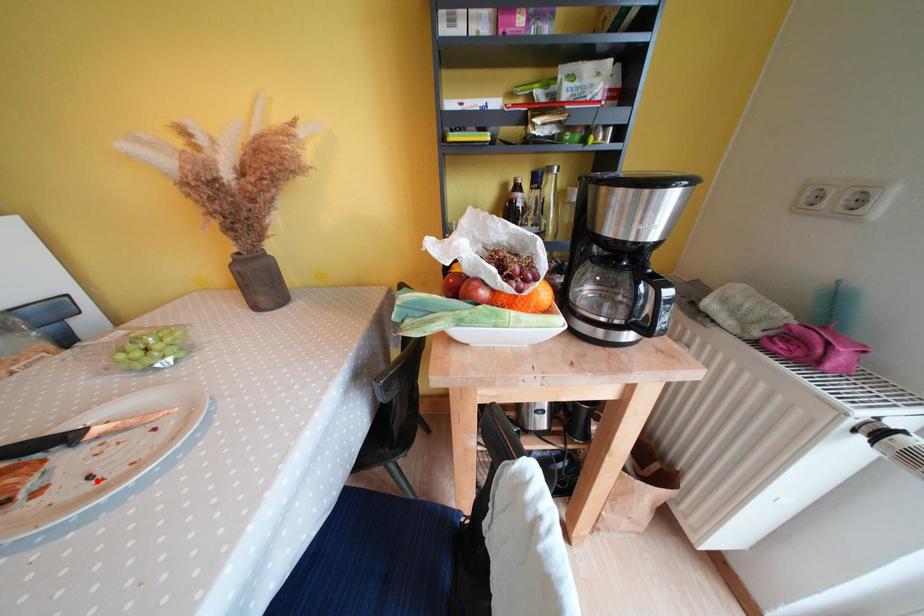
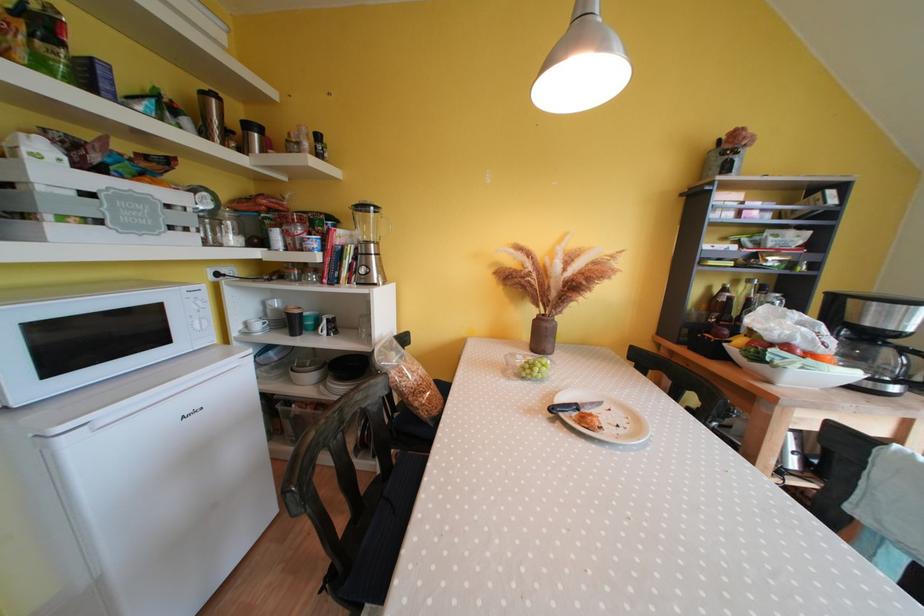
In the second image, find the point that corresponds to the highlighted location in the first image.

(624, 430)